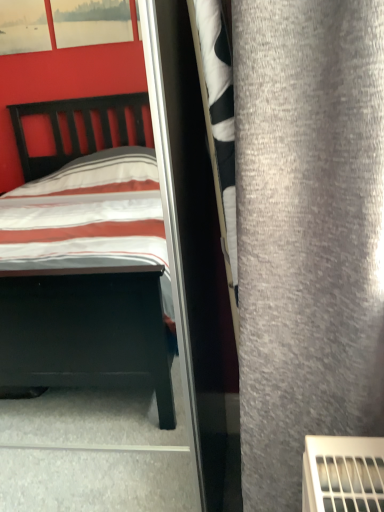
Question: Considering the positions of point (274, 242) and point (162, 327), is point (274, 242) closer or farther from the camera than point (162, 327)?

Choices:
 (A) closer
 (B) farther

Answer: (A)

Question: Considering the positions of gray fabric curtain at right and striped fabric bed at left in the image, is gray fabric curtain at right taller or shorter than striped fabric bed at left?

Choices:
 (A) tall
 (B) short

Answer: (B)

Question: Which is farther from the striped fabric bed at left?

Choices:
 (A) clear glass screen door at center
 (B) gray fabric curtain at right

Answer: (B)

Question: Which is nearer to the striped fabric bed at left?

Choices:
 (A) gray fabric curtain at right
 (B) clear glass screen door at center

Answer: (B)